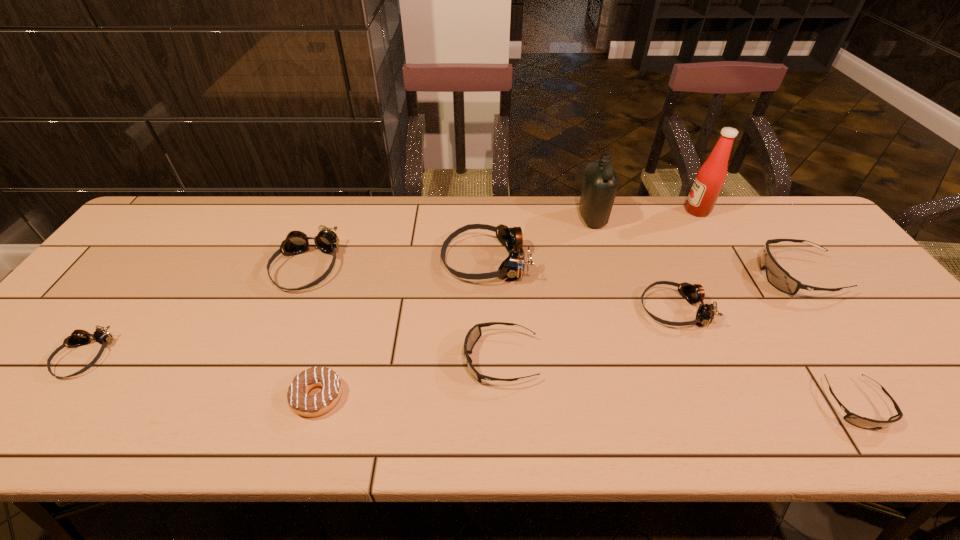
The height and width of the screenshot is (540, 960). Find the location of `object at the right edge`. object at the right edge is located at coordinates (777, 276).

What are the coordinates of `vacant space at the far edge of the desktop` in the screenshot? It's located at (693, 225).

Find the location of a particular element. free space at the near edge is located at coordinates (605, 410).

The width and height of the screenshot is (960, 540). Identify the location of vacant region at the left edge of the desktop. (92, 318).

Find the location of a particular element. The image size is (960, 540). free spot at the right edge of the desktop is located at coordinates (815, 266).

In the image, there is a desktop. Where is `vacant area at the far left corner`? The width and height of the screenshot is (960, 540). vacant area at the far left corner is located at coordinates (173, 217).

Image resolution: width=960 pixels, height=540 pixels. Find the location of `vacant space at the far right corner of the desktop`. vacant space at the far right corner of the desktop is located at coordinates (790, 225).

The width and height of the screenshot is (960, 540). Find the location of `unoccupied position between the leftmost black goggles and the farthest black goggles`. unoccupied position between the leftmost black goggles and the farthest black goggles is located at coordinates pos(649,318).

This screenshot has width=960, height=540. I want to click on vacant space that's between the second smallest bronze goggles and the smallest bronze goggles, so click(x=379, y=333).

The width and height of the screenshot is (960, 540). Identify the location of free space between the second smallest bronze goggles and the farthest black goggles. (x=735, y=293).